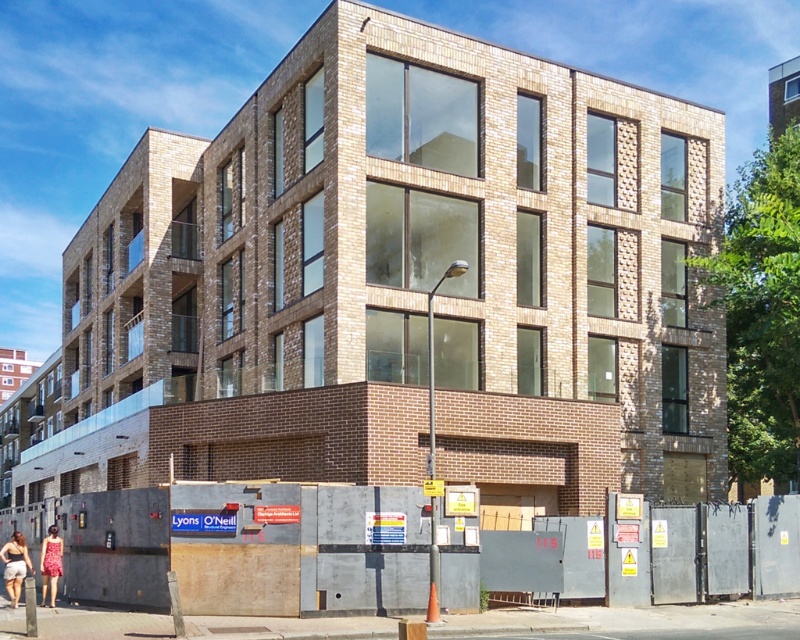
From the picture: You are a delivery person approaching the residential building and see the light pink cotton dress at lower left and the floral dress at lower left. Which dress is taller?

The light pink cotton dress at lower left is taller than the floral dress at lower left.

You are a delivery person approaching the residential building and need to place a package at the location marked by point (54,540). However, there is an obstacle at point (10,547). Which point is closer to you, and thus easier to navigate around?

Point (10,547) is closer to the viewer than point (54,540). Therefore, the obstacle at point (10,547) is closer, so you should navigate around it first before reaching the package location at point (54,540).

You are a delivery person approaching the residential building and see both the light pink cotton dress at lower left and the floral dress at lower left. Which dress should you avoid stepping on since it is closer to your path?

The light pink cotton dress at lower left is closer to the viewer than the floral dress at lower left, so you should avoid stepping on the light pink cotton dress at lower left since it is closer to your path.